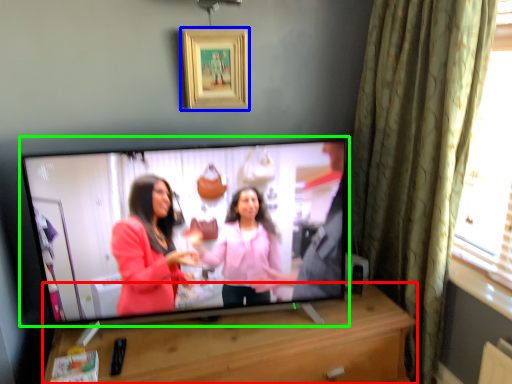
Question: Estimate the real-world distances between objects in this image. Which object is closer to furniture (highlighted by a red box), picture frame (highlighted by a blue box) or television (highlighted by a green box)?

Choices:
 (A) picture frame
 (B) television

Answer: (B)